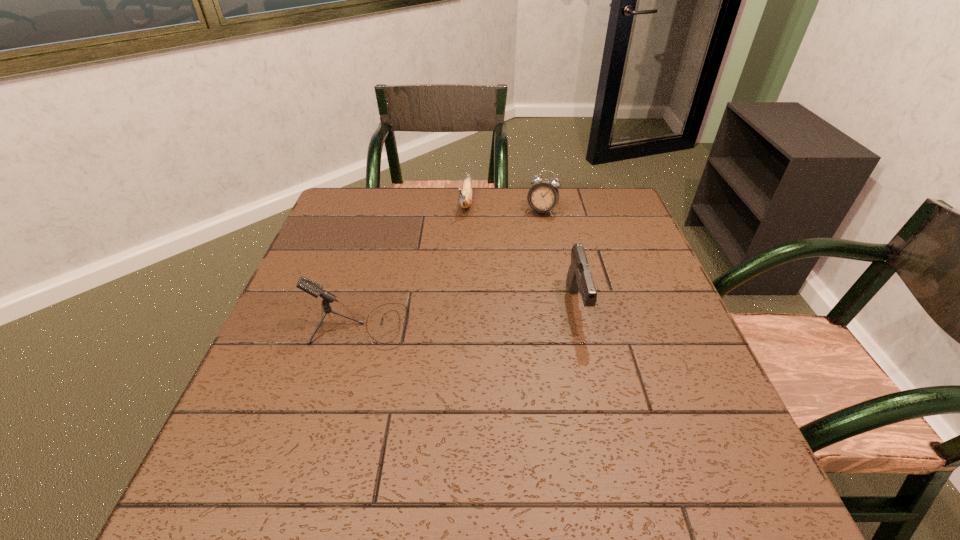
Image resolution: width=960 pixels, height=540 pixels. In order to click on free location located on the peel of the second object from left to right in this screenshot , I will do `click(452, 285)`.

The height and width of the screenshot is (540, 960). Identify the location of blank area located on the peel of the second object from left to right. (448, 305).

I want to click on vacant space situated on the peel of the second object from left to right, so point(453,282).

Locate an element on the screen. alarm clock present at the far edge is located at coordinates (542, 197).

The width and height of the screenshot is (960, 540). In order to click on banana that is at the far edge in this screenshot , I will do `click(465, 200)`.

Image resolution: width=960 pixels, height=540 pixels. Find the location of `object that is at the left edge`. object that is at the left edge is located at coordinates (314, 289).

This screenshot has height=540, width=960. I want to click on free point at the far edge, so click(x=452, y=188).

Identify the location of vacant region at the near edge of the desktop. The image size is (960, 540). (516, 413).

The image size is (960, 540). What are the coordinates of `vacant space at the left edge` in the screenshot? It's located at (269, 363).

I want to click on vacant space at the right edge, so click(684, 341).